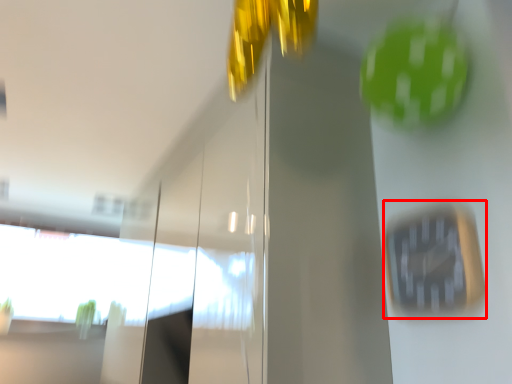
Question: Where is clock (annotated by the red box) located in relation to window in the image?

Choices:
 (A) left
 (B) right

Answer: (B)